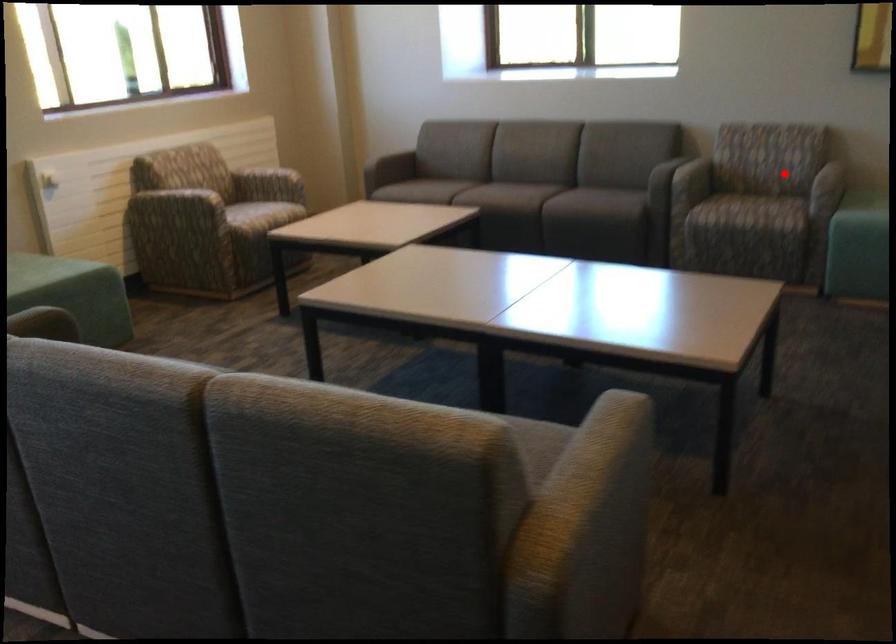
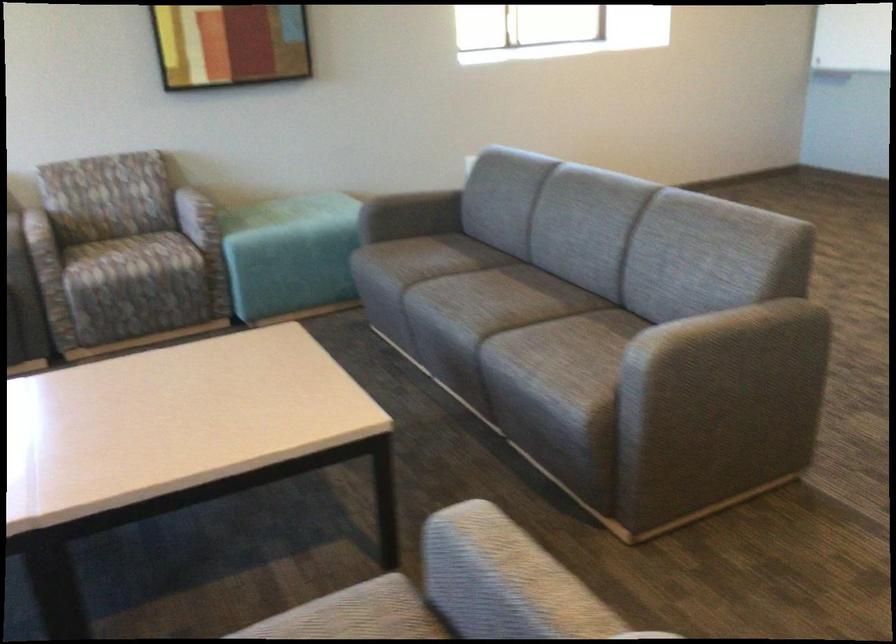
Question: I am providing you with two images of the same scene from different viewpoints. A red point is shown in image1. For the corresponding object point in image2, is it positioned nearer or farther from the camera?

Choices:
 (A) Nearer
 (B) Farther

Answer: (A)